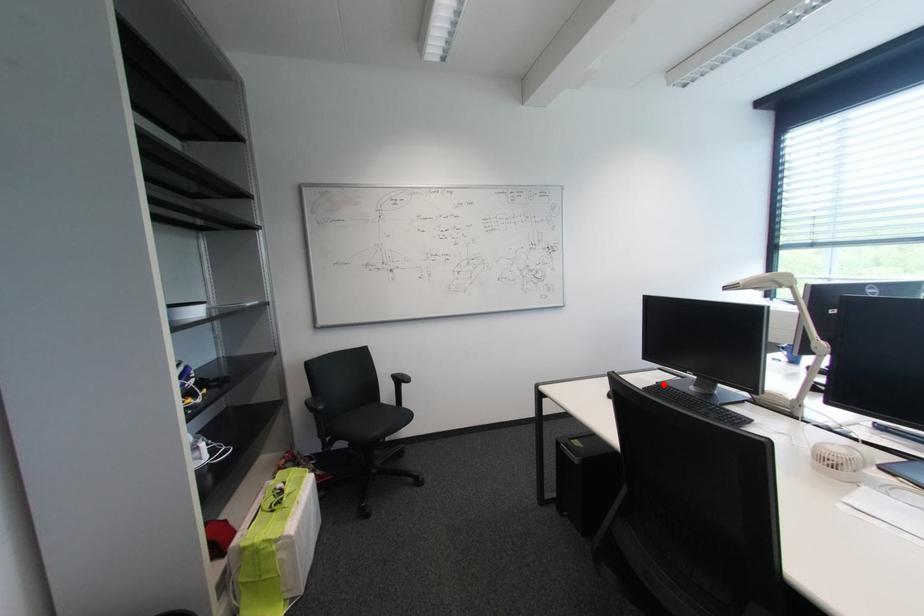
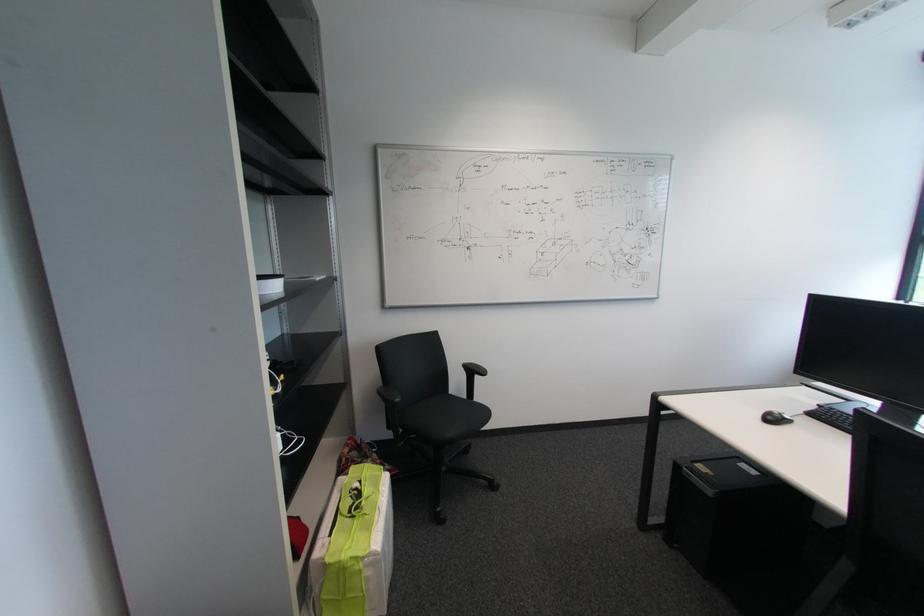
In the second image, find the point that corresponds to the highlighted location in the first image.

(825, 407)